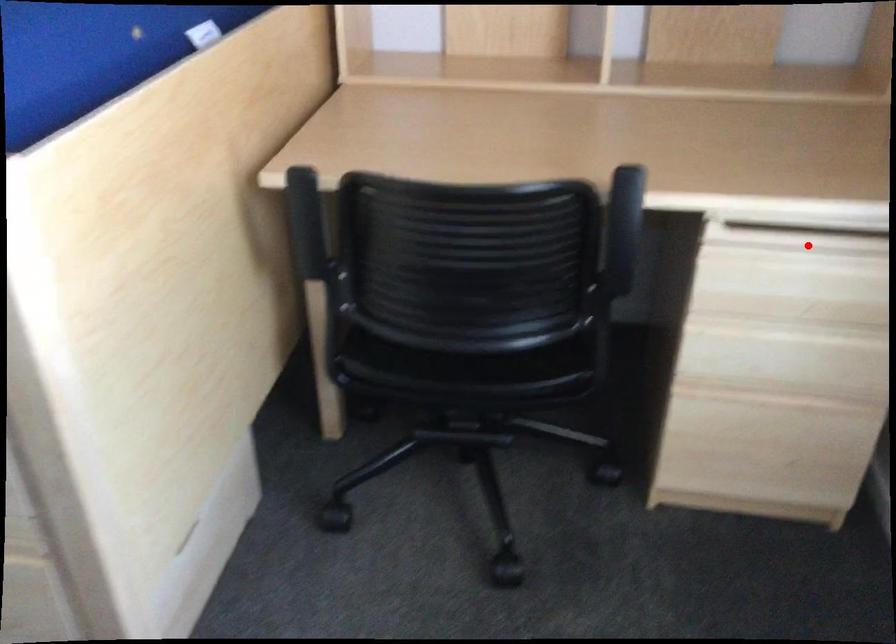
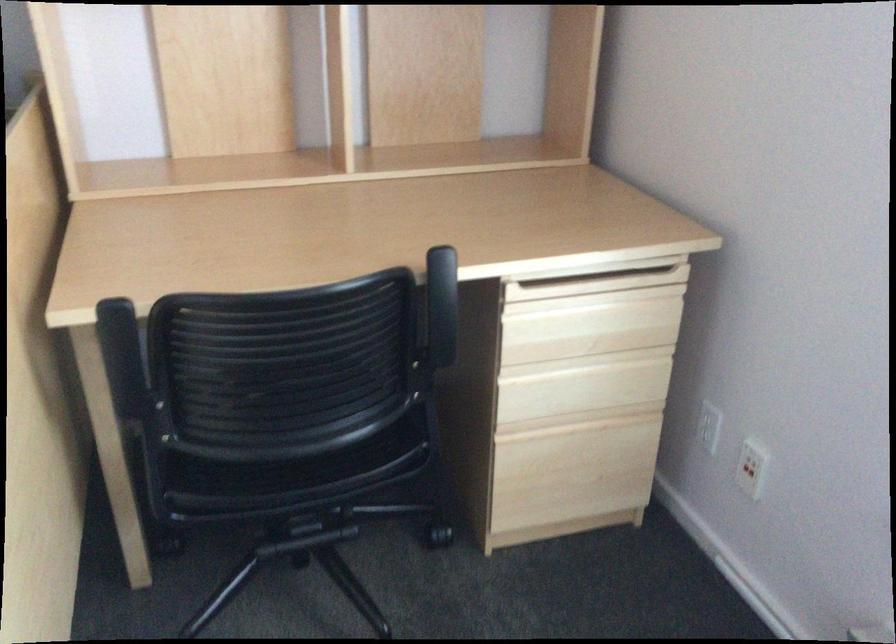
Question: I am providing you with two images of the same scene from different viewpoints. A red point is shown in image1. For the corresponding object point in image2, is it positioned nearer or farther from the camera?

Choices:
 (A) Nearer
 (B) Farther

Answer: (B)